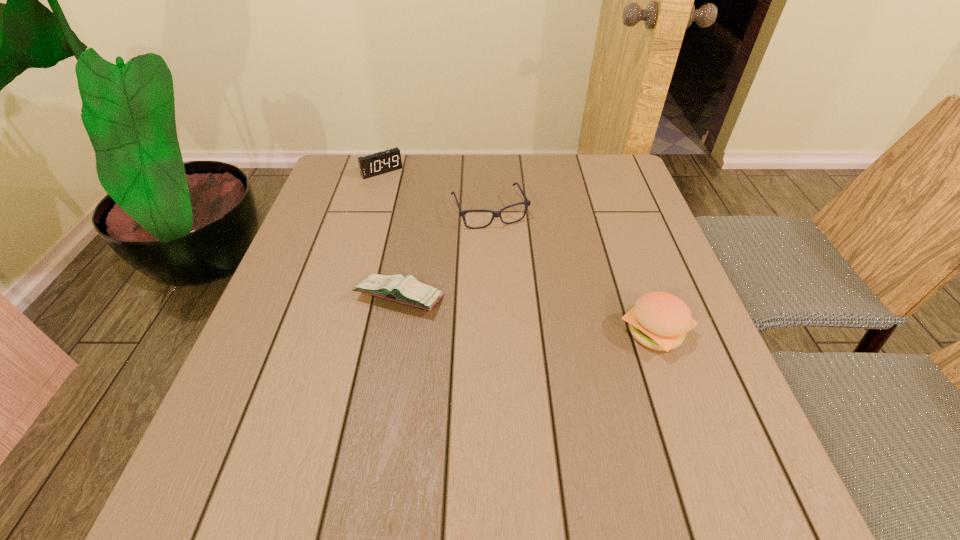
You are a GUI agent. You are given a task and a screenshot of the screen. Output one action in this format:
    pyautogui.click(x=<x>, y=<y>)
    Task: Click on the free region located on the front-facing side of the third nearest object
    
    Given the screenshot: What is the action you would take?
    pyautogui.click(x=522, y=278)

Find the location of `free point located on the front-facing side of the third nearest object`. free point located on the front-facing side of the third nearest object is located at coordinates (513, 258).

This screenshot has height=540, width=960. Find the location of `vacant area located on the front-facing side of the third nearest object`. vacant area located on the front-facing side of the third nearest object is located at coordinates pos(529,294).

Locate an element on the screen. This screenshot has width=960, height=540. alarm clock located at the far edge is located at coordinates (371, 165).

Find the location of a particular element. The image size is (960, 540). spectacles located at the far edge is located at coordinates (527, 203).

At what (x,y) coordinates should I click in order to perform the action: click on object present at the left edge. Please return your answer as a coordinate pair (x, y). The width and height of the screenshot is (960, 540). Looking at the image, I should click on (371, 165).

Locate an element on the screen. The image size is (960, 540). object positioned at the right edge is located at coordinates (660, 321).

Where is `object located at the far left corner`? The width and height of the screenshot is (960, 540). object located at the far left corner is located at coordinates (371, 165).

Image resolution: width=960 pixels, height=540 pixels. I want to click on vacant space at the far edge of the desktop, so click(x=515, y=173).

The height and width of the screenshot is (540, 960). Identify the location of vacant region at the left edge. (304, 348).